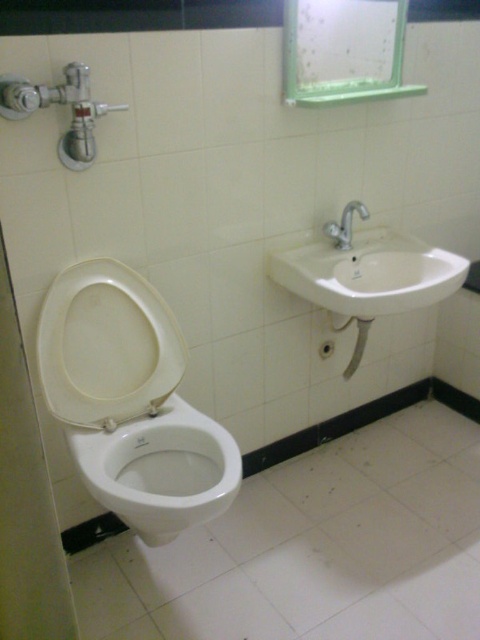
Question: Can you confirm if white ceramic sink at upper right is positioned above silver metallic faucet at upper right?

Choices:
 (A) no
 (B) yes

Answer: (A)

Question: Estimate the real-world distances between objects in this image. Which object is closer to the white matte toilet lid at center?

Choices:
 (A) white glossy bidet at lower left
 (B) silver metallic faucet at upper right

Answer: (A)

Question: Which point appears closest to the camera in this image?

Choices:
 (A) (146, 458)
 (B) (464, 280)

Answer: (A)

Question: Which point is closer to the camera?

Choices:
 (A) (122, 308)
 (B) (314, 250)
 (C) (224, 451)
 (D) (359, 200)

Answer: (C)

Question: Can you confirm if white glossy bidet at lower left is wider than white ceramic sink at upper right?

Choices:
 (A) yes
 (B) no

Answer: (B)

Question: Is white ceramic sink at upper right behind silver metallic faucet at upper right?

Choices:
 (A) yes
 (B) no

Answer: (B)